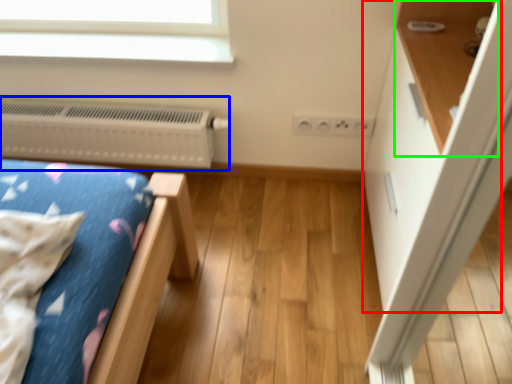
Question: Which object is positioned closest to dresser (highlighted by a red box)? Select from heater (highlighted by a blue box) and shelf (highlighted by a green box).

Choices:
 (A) heater
 (B) shelf

Answer: (B)